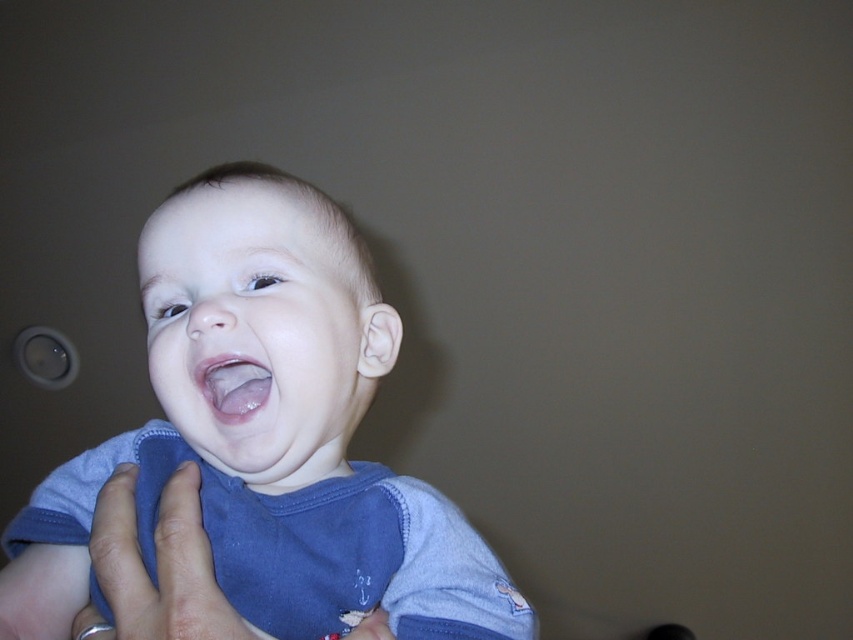
You are holding a baby in your arms and want to place a small toy 18 inches away from the baby. The baby is at point (132,563). Can you place the toy at the same point as the baby?

The distance between point (132,563) and the viewer is 18.14 inches. To place the toy 18 inches away from the baby, you can position it near the baby since the distance from the baby to the viewer is already approximately 18 inches. However, placing the toy at the same point as the baby would mean it is 0 inches away, not 18. Choose a spot slightly away from the baby to achieve the desired distance.

You are holding a baby wearing a blue long sleeve shirt and want to place a pacifier at point (364,557). If your hand is 19.35 inches away from the baby, can you reach the pacifier without moving your hand?

The point (364,557) is 19.35 inches away from the viewer, so yes, your hand can reach the pacifier at that point since it is exactly at the same distance as your hand.